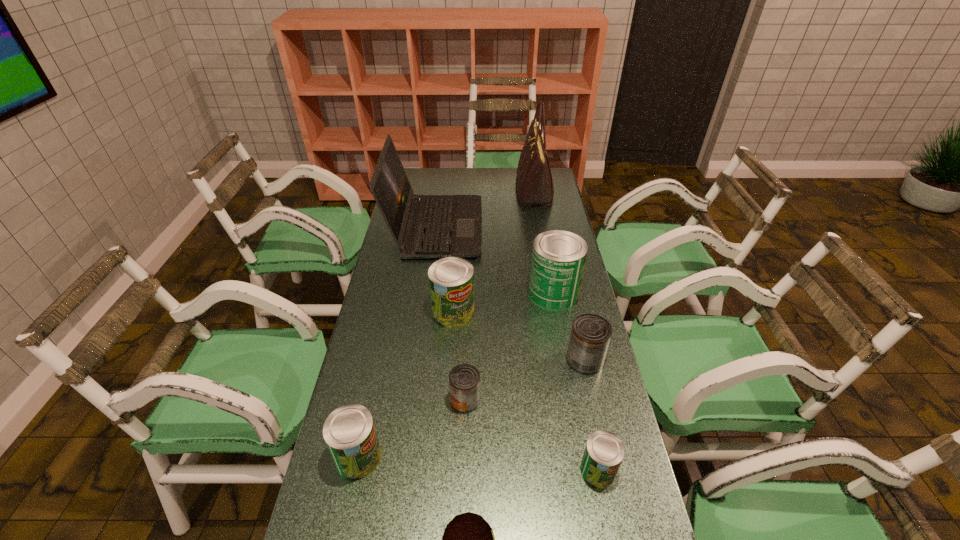
Find the location of a particular element. The height and width of the screenshot is (540, 960). the tallest object is located at coordinates (534, 184).

You are a GUI agent. You are given a task and a screenshot of the screen. Output one action in this format:
    pyautogui.click(x=<x>, y=<y>)
    Task: Click on the laptop_computer
    Image resolution: width=960 pixels, height=540 pixels.
    Given the screenshot: What is the action you would take?
    pyautogui.click(x=423, y=226)

I want to click on the eighth shortest object, so click(423, 226).

Where is `the third tallest object`? The height and width of the screenshot is (540, 960). the third tallest object is located at coordinates (558, 259).

Locate an element on the screen. The width and height of the screenshot is (960, 540). the tallest can is located at coordinates (558, 259).

The width and height of the screenshot is (960, 540). Identify the location of the fourth tallest object. (451, 280).

Locate an element on the screen. This screenshot has width=960, height=540. the third smallest green can is located at coordinates click(451, 280).

Where is `the second smallest green can`? Image resolution: width=960 pixels, height=540 pixels. the second smallest green can is located at coordinates (349, 432).

I want to click on the leftmost can, so click(x=349, y=432).

At what (x,y) coordinates should I click in order to perform the action: click on the bigger red can. Please return your answer as a coordinate pair (x, y). This screenshot has height=540, width=960. Looking at the image, I should click on (590, 336).